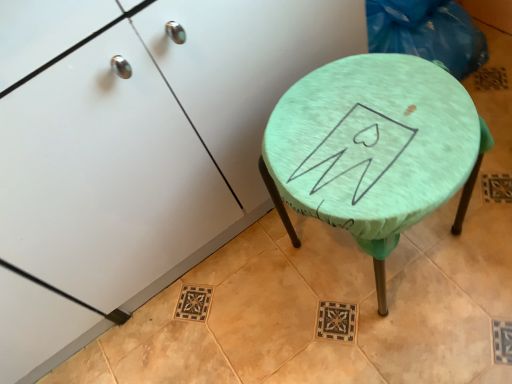
I want to click on blank space above teal fabric-covered stool at center (from a real-world perspective), so click(x=373, y=125).